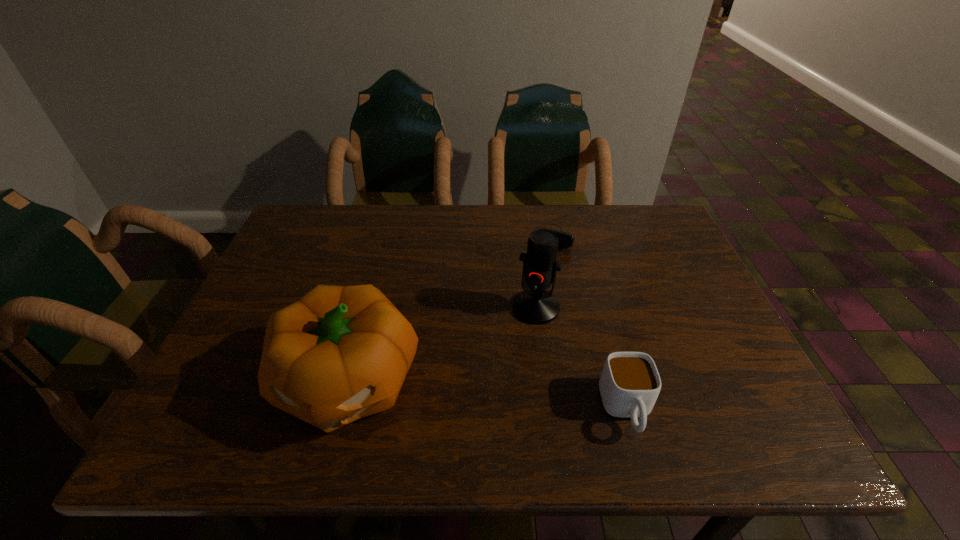
Where is `free point between the third tallest object and the microphone`? free point between the third tallest object and the microphone is located at coordinates (581, 359).

Image resolution: width=960 pixels, height=540 pixels. I want to click on object that ranks as the closest to the leftmost object, so click(x=534, y=305).

Locate an element on the screen. Image resolution: width=960 pixels, height=540 pixels. the third closest object to the leftmost object is located at coordinates (566, 240).